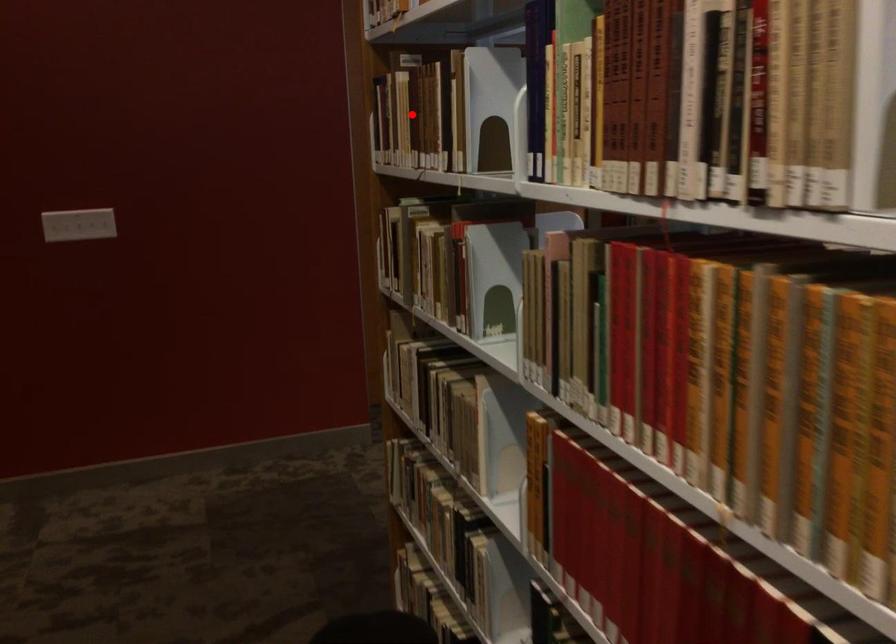
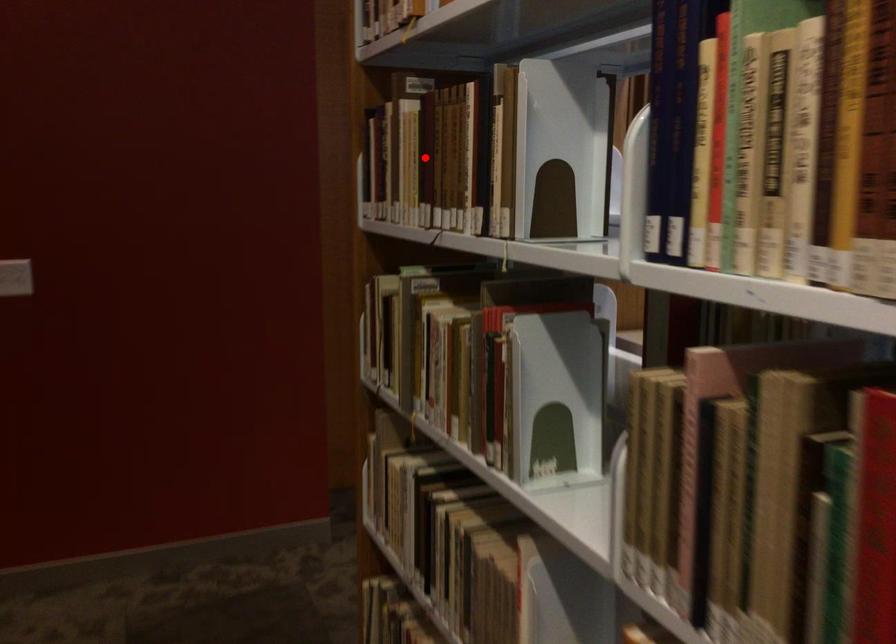
I am providing you with two images of the same scene from different viewpoints. A red point is marked on the first image and another point is marked on the second image. Is the marked point in image1 the same physical position as the marked point in image2?

Yes